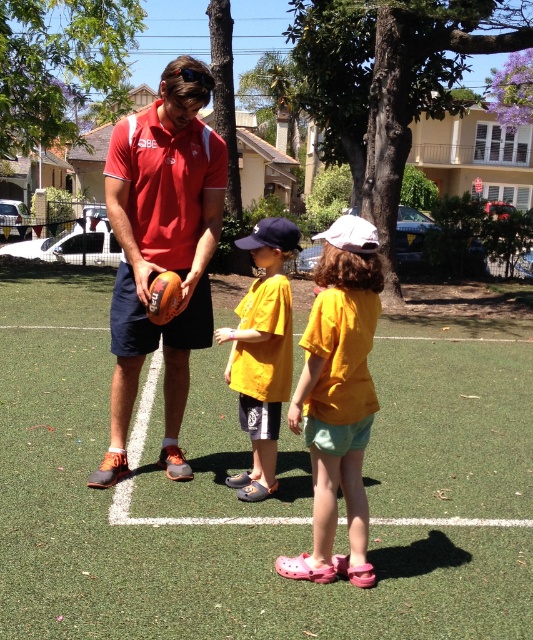
Is green turf football field at center bigger than matte red polo shirt at center?

Correct, green turf football field at center is larger in size than matte red polo shirt at center.

The width and height of the screenshot is (533, 640). What do you see at coordinates (260, 502) in the screenshot? I see `green turf football field at center` at bounding box center [260, 502].

This screenshot has width=533, height=640. Find the location of `green turf football field at center`. green turf football field at center is located at coordinates (260, 502).

Is the position of yellow matte shirt at center more distant than that of yellow cotton shirt at center?

No, yellow matte shirt at center is closer to the viewer.

Who is positioned more to the right, yellow matte shirt at center or yellow cotton shirt at center?

From the viewer's perspective, yellow matte shirt at center appears more on the right side.

Who is more forward, [337,392] or [269,451]?

Point [337,392]

Locate an element on the screen. yellow matte shirt at center is located at coordinates (338, 397).

Between matte red polo shirt at center and yellow matte shirt at center, which one is positioned higher?

matte red polo shirt at center is above.

Can you confirm if matte red polo shirt at center is shorter than yellow matte shirt at center?

Incorrect, matte red polo shirt at center's height does not fall short of yellow matte shirt at center's.

What are the coordinates of `matte red polo shirt at center` in the screenshot? It's located at (161, 250).

At what (x,y) coordinates should I click in order to perform the action: click on matte red polo shirt at center. Please return your answer as a coordinate pair (x, y). Looking at the image, I should click on (161, 250).